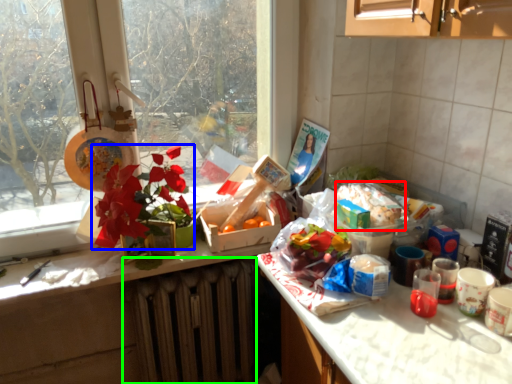
Question: Which is farther away from food (highlighted by a red box)? flower (highlighted by a blue box) or radiator (highlighted by a green box)?

Choices:
 (A) flower
 (B) radiator

Answer: (B)